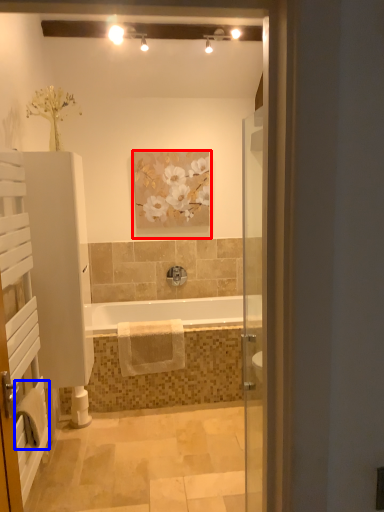
Question: Which object is closer to the camera taking this photo, picture frame (highlighted by a red box) or bath towel (highlighted by a blue box)?

Choices:
 (A) picture frame
 (B) bath towel

Answer: (B)